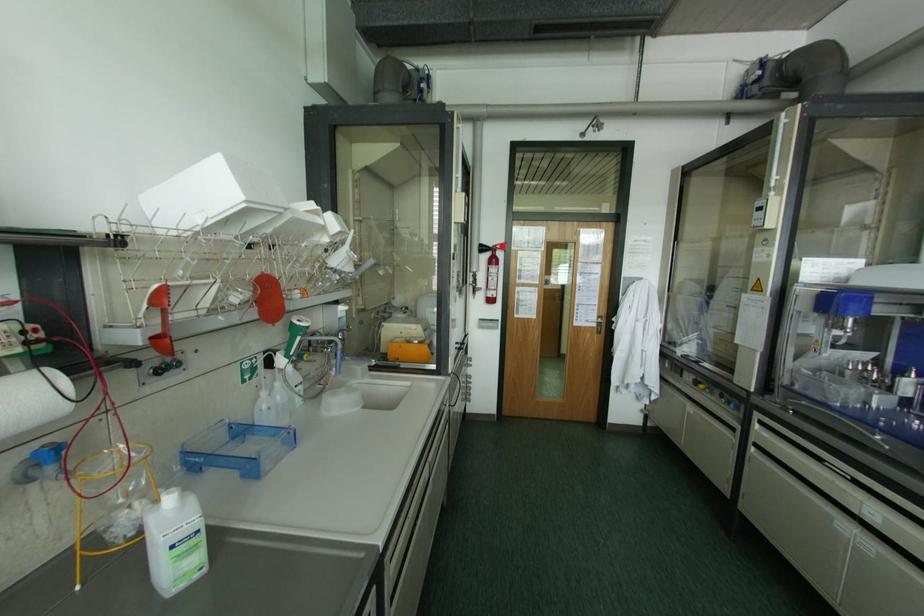
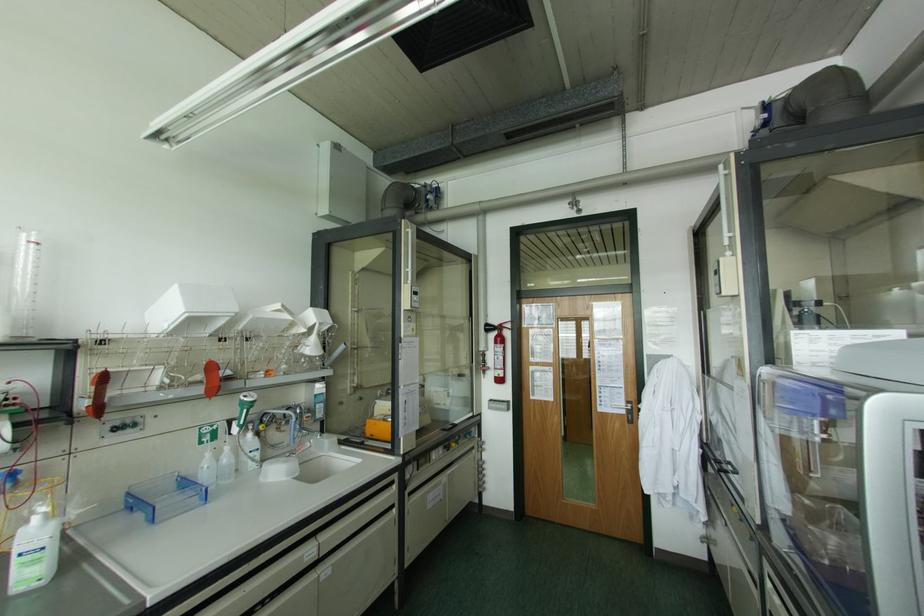
Where in the second image is the point corresponding to the highlighted location from the first image?

(507, 325)